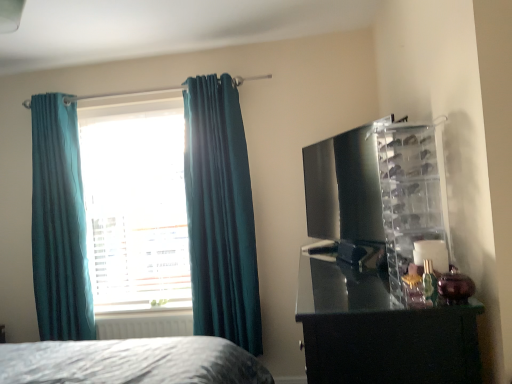
Question: Is white matte radiator at lower left shorter than glossy black dresser at right?

Choices:
 (A) yes
 (B) no

Answer: (A)

Question: Considering the relative sizes of white matte radiator at lower left and glossy black dresser at right in the image provided, is white matte radiator at lower left wider than glossy black dresser at right?

Choices:
 (A) no
 (B) yes

Answer: (A)

Question: From the image's perspective, does white matte radiator at lower left appear higher than glossy black dresser at right?

Choices:
 (A) yes
 (B) no

Answer: (B)

Question: Does white matte radiator at lower left have a smaller size compared to glossy black dresser at right?

Choices:
 (A) no
 (B) yes

Answer: (B)

Question: From a real-world perspective, is white matte radiator at lower left below glossy black dresser at right?

Choices:
 (A) no
 (B) yes

Answer: (B)

Question: Is glossy black dresser at right inside white matte radiator at lower left?

Choices:
 (A) yes
 (B) no

Answer: (B)

Question: Would you consider teal velvet curtains at left, which is the 1th curtain from right to left, to be distant from clear plastic shoe rack at right?

Choices:
 (A) no
 (B) yes

Answer: (B)

Question: Is teal velvet curtains at left, which is the 1th curtain from right to left, wider than clear plastic shoe rack at right?

Choices:
 (A) yes
 (B) no

Answer: (B)

Question: Does teal velvet curtains at left, the 2th curtain from the left, have a greater height compared to clear plastic shoe rack at right?

Choices:
 (A) no
 (B) yes

Answer: (B)

Question: From a real-world perspective, is teal velvet curtains at left, the 2th curtain from the left, below clear plastic shoe rack at right?

Choices:
 (A) no
 (B) yes

Answer: (B)

Question: Is teal velvet curtains at left, which is the 1th curtain from right to left, to the right of clear plastic shoe rack at right from the viewer's perspective?

Choices:
 (A) no
 (B) yes

Answer: (A)

Question: Is clear plastic shoe rack at right at the back of teal velvet curtains at left, which is the 1th curtain from right to left?

Choices:
 (A) no
 (B) yes

Answer: (A)

Question: Is glossy black dresser at right surrounding teal fabric curtain at left, the first curtain from the left?

Choices:
 (A) yes
 (B) no

Answer: (B)